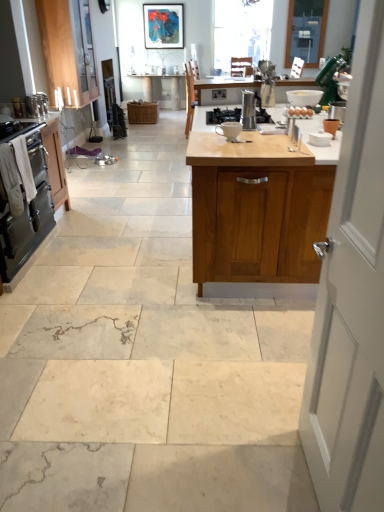
Question: From the image's perspective, is wooden cabinet at upper left, which ranks as the first cabinetry in left-to-right order, positioned above or below matte black picture frame at upper center?

Choices:
 (A) below
 (B) above

Answer: (A)

Question: From a real-world perspective, is wooden cabinet at upper left, which ranks as the first cabinetry in left-to-right order, physically located above or below matte black picture frame at upper center?

Choices:
 (A) below
 (B) above

Answer: (A)

Question: Based on their relative distances, which object is farther from the terracotta clay pot at upper right, which is counted as the 1th appliance, starting from the right?

Choices:
 (A) metallic silver coffee maker at center, the fourth appliance viewed from the left
 (B) white towel oven at left, which is counted as the second cabinetry, starting from the right
 (C) metallic silver kettle at left, marked as the first appliance in a left-to-right arrangement
 (D) black matte gas stove at center
 (E) clear glass window at upper center

Answer: (E)

Question: Considering the real-world distances, which object is farthest from the satin silver cabinet at center?

Choices:
 (A) brown matte eggs at center
 (B) matte black picture frame at upper center
 (C) light wood cabinet at center, the first cabinetry positioned from the right
 (D) terracotta clay pot at upper right, the fourth appliance positioned from the back
 (E) white towel oven at left, which is counted as the second cabinetry, starting from the right

Answer: (C)